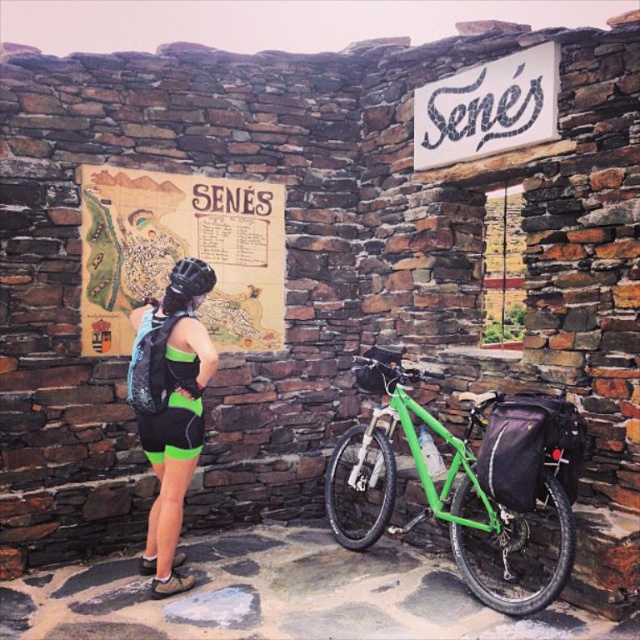
Question: Which of the following is the farthest from the observer?

Choices:
 (A) (545, 488)
 (B) (157, 273)

Answer: (B)

Question: Which point is farther to the camera?

Choices:
 (A) wooden map at center
 (B) matte black helmet at upper left

Answer: (A)

Question: Which of these objects is positioned farthest from the matte black helmet at upper left?

Choices:
 (A) wooden map at center
 (B) green matte bicycle at center

Answer: (B)

Question: Is green matte bicycle at center below wooden map at center?

Choices:
 (A) yes
 (B) no

Answer: (A)

Question: Does green matte bicycle at center have a lesser width compared to matte black helmet at upper left?

Choices:
 (A) no
 (B) yes

Answer: (A)

Question: Is green matte bicycle at center above matte black helmet at upper left?

Choices:
 (A) yes
 (B) no

Answer: (B)